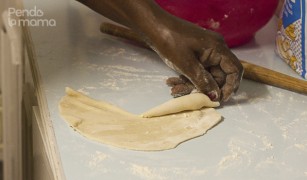
This screenshot has height=180, width=307. I want to click on cupboard door, so click(x=40, y=154), click(x=26, y=81), click(x=13, y=41).